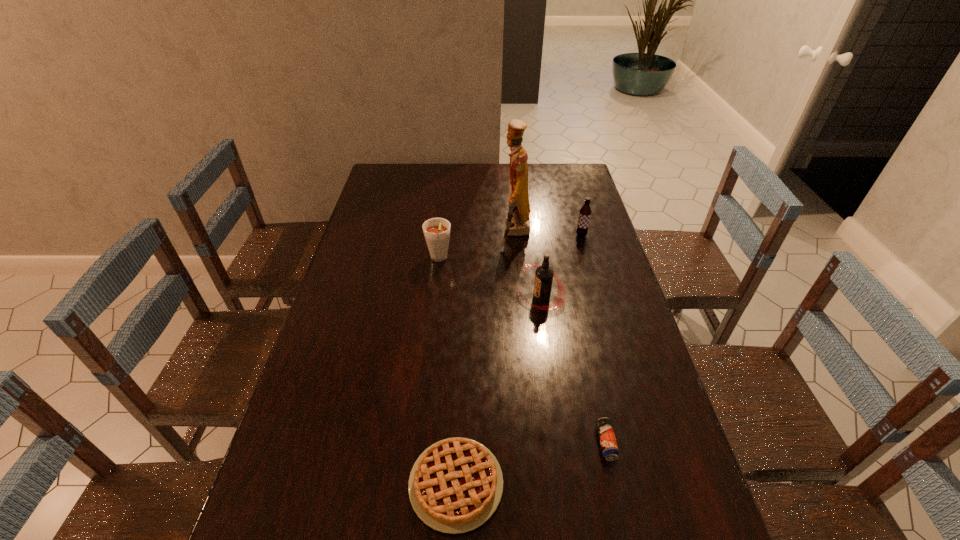
Find the location of a particular element. The image size is (960, 540). vacant point that satisfies the following two spatial constraints: 1. on the front-facing side of the farthest root beer; 2. on the right side of the nutcracker is located at coordinates click(516, 235).

Identify the location of vacant region that satisfies the following two spatial constraints: 1. on the label of the third nearest object; 2. on the left side of the second object from right to left. Image resolution: width=960 pixels, height=540 pixels. (562, 443).